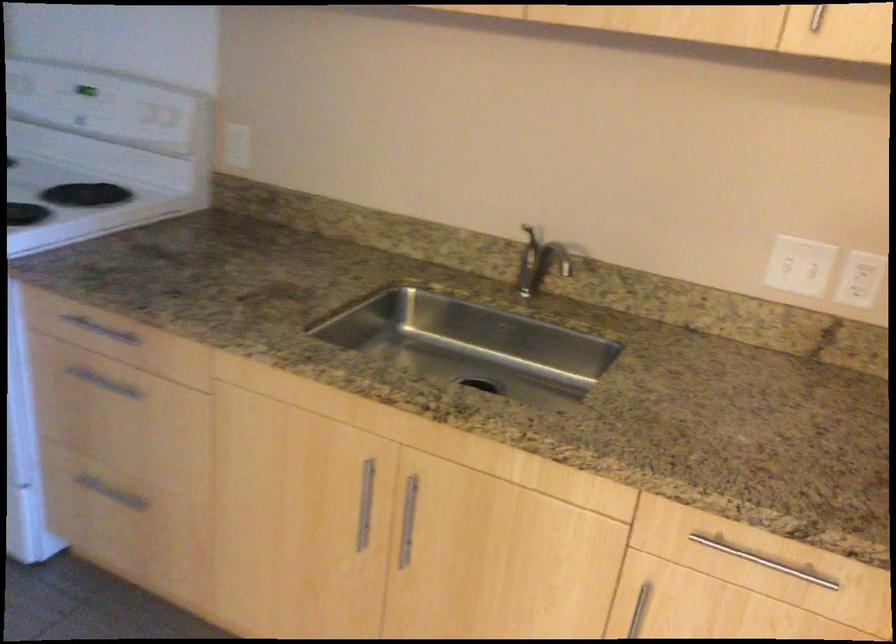
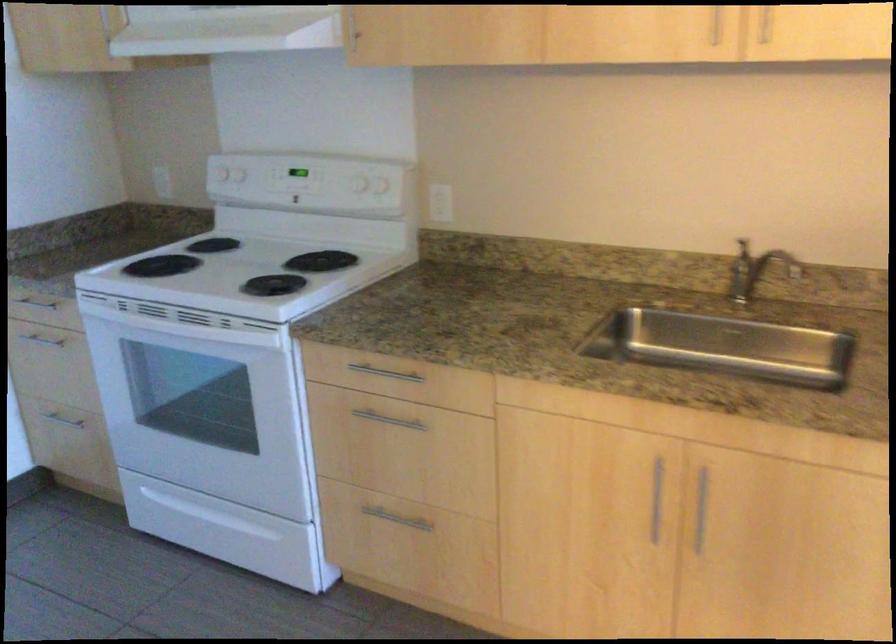
The images are taken continuously from a first-person perspective. In which direction are you moving?

The cameraman walked toward left, backward.